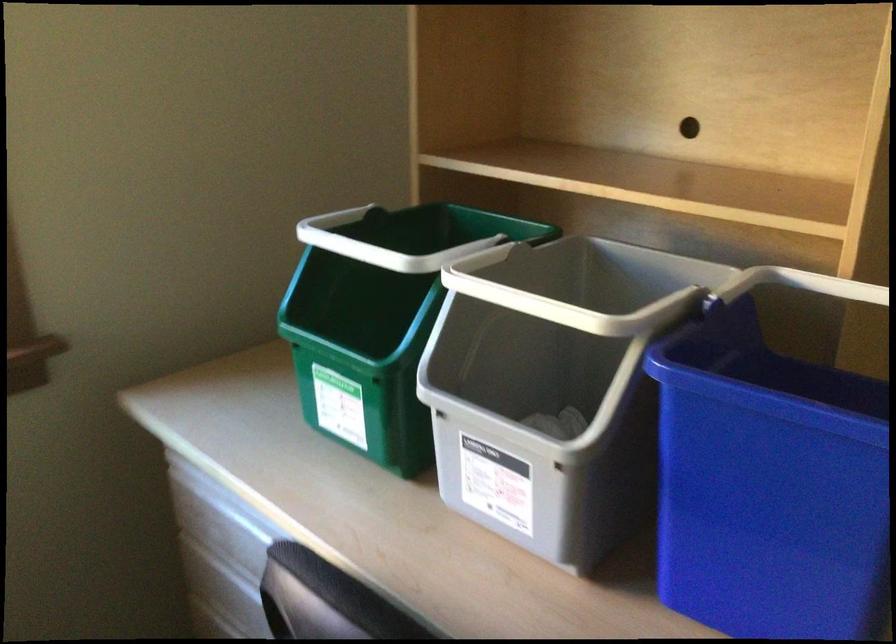
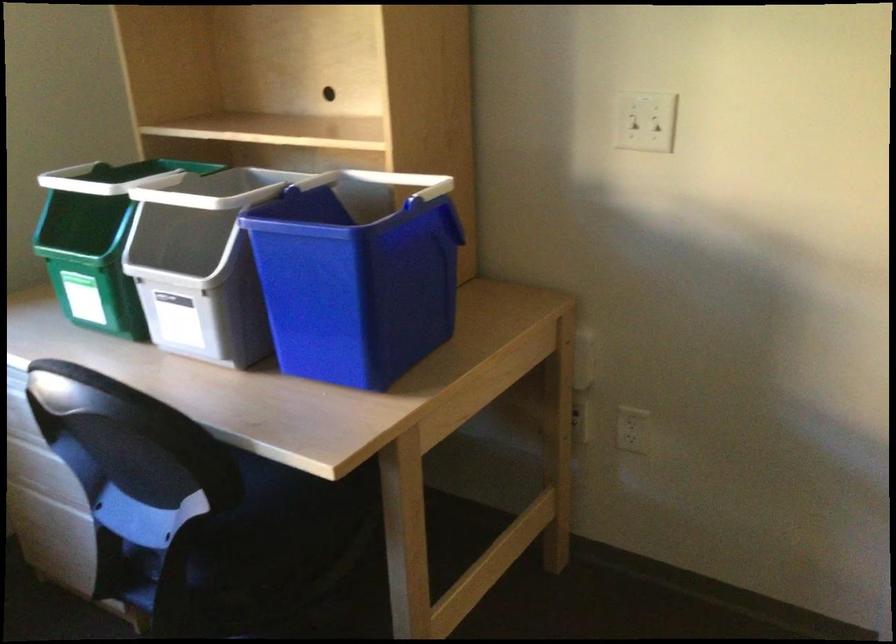
Question: I am providing you with two images of the same scene from different viewpoints. After the viewpoint changes to image2, which objects are now occluded?

Choices:
 (A) green bin handle
 (B) chair sitting surface
 (C) blue bin handle
 (D) none of these

Answer: (D)